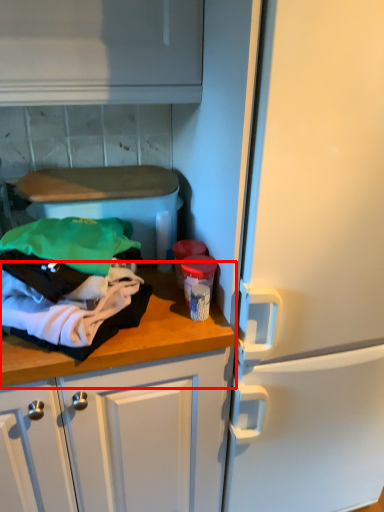
Question: Considering the relative positions of countertop (annotated by the red box) and clothing in the image provided, where is countertop (annotated by the red box) located with respect to the staircase?

Choices:
 (A) left
 (B) right

Answer: (B)